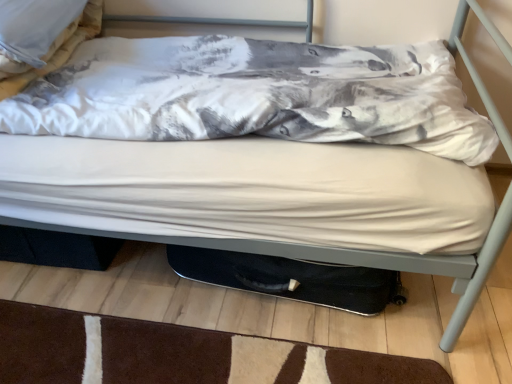
Describe the element at coordinates (178, 354) in the screenshot. This screenshot has height=384, width=512. I see `brown plush rug at lower center` at that location.

I want to click on brown plush rug at lower center, so click(x=178, y=354).

Locate an element on the screen. brown plush rug at lower center is located at coordinates (178, 354).